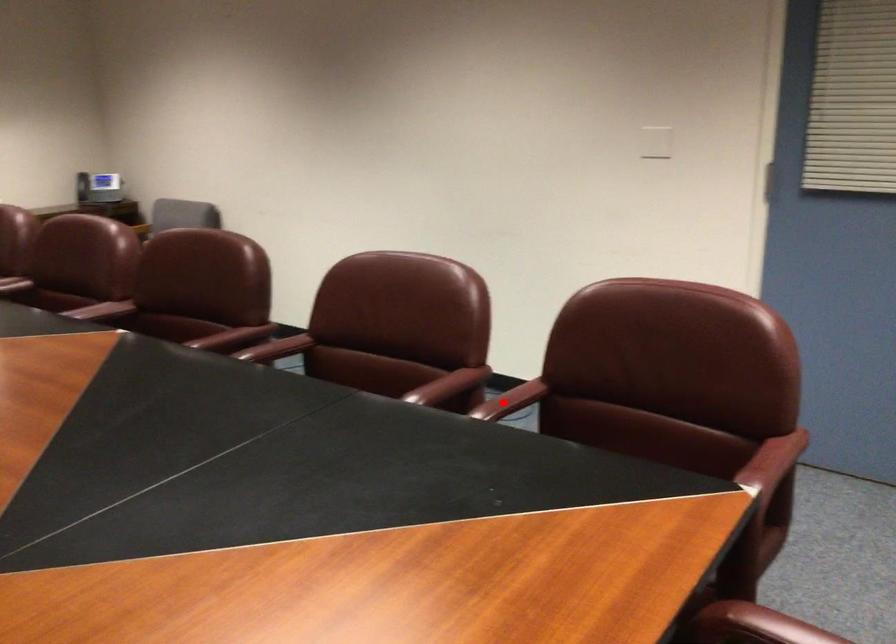
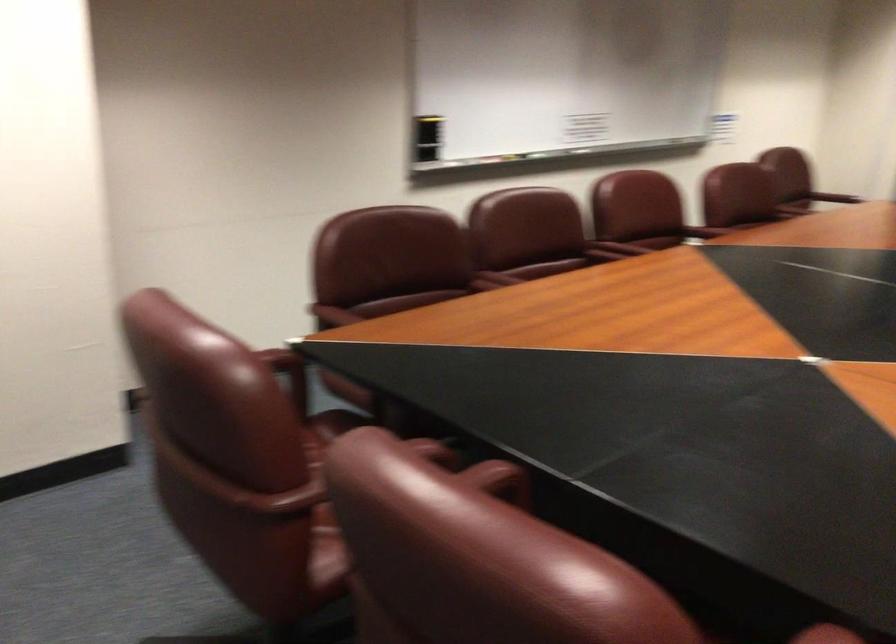
Question: I am providing you with two images of the same scene from different viewpoints. In image1, a red point is highlighted. Considering the same 3D point in image2, which of the following is correct?

Choices:
 (A) It is closer
 (B) It is farther

Answer: (A)